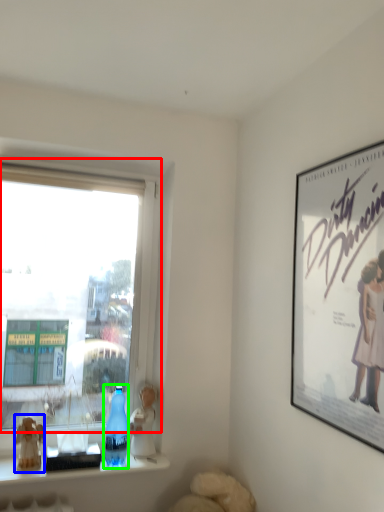
Question: Which is nearer to the window (highlighted by a red box)? figurine (highlighted by a blue box) or bottle (highlighted by a green box).

Choices:
 (A) figurine
 (B) bottle

Answer: (B)